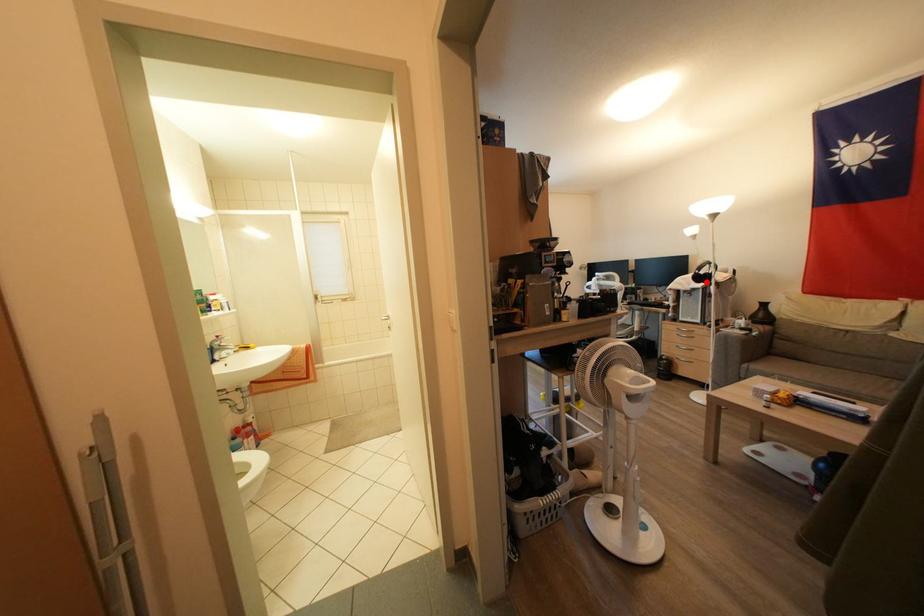
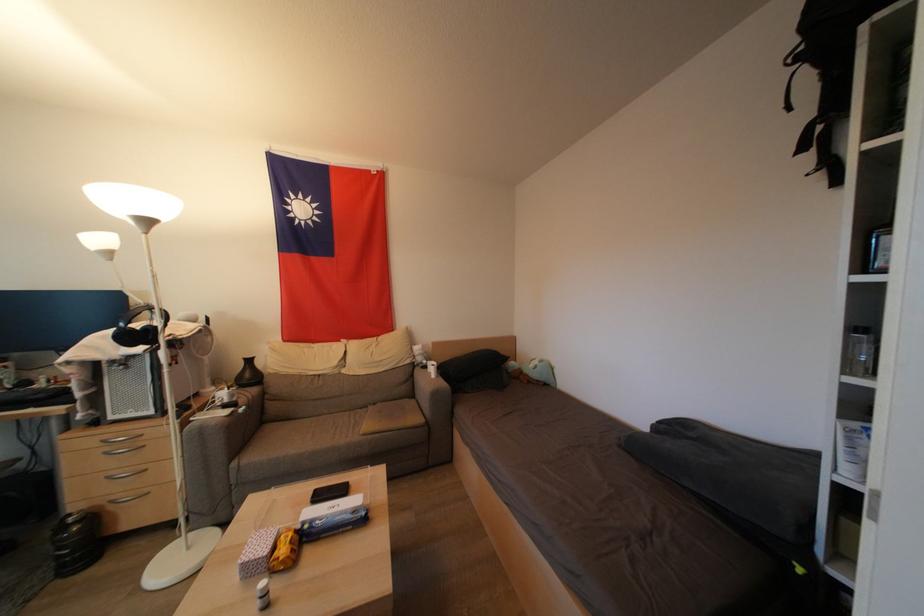
In the second image, find the point that corresponds to the highlighted location in the first image.

(142, 339)